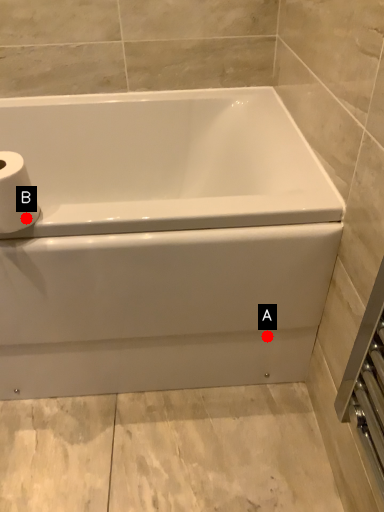
Question: Two points are circled on the image, labeled by A and B beside each circle. Which point is farther from the camera taking this photo?

Choices:
 (A) A is further
 (B) B is further

Answer: (A)